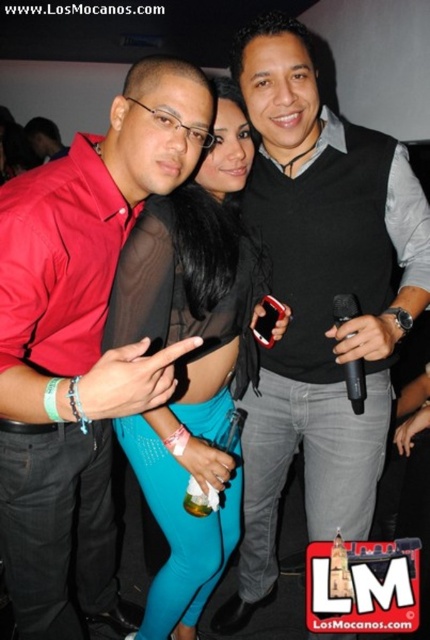
You are standing at the entrance of the nightclub and see two points in the image. The first point is at coordinates point (280,134) and the second is at point (171,330). Which point is closer to you?

Point (280,134) is in front of point (171,330), so it is closer to you.

You are a photographer trying to capture the woman in the center. You notice two items on her upper body, the black matte vest at center and the satin black top at center. Which one appears closer to you in the photo?

The black matte vest at center appears closer to you because it is positioned closer to the viewer than the satin black top at center.